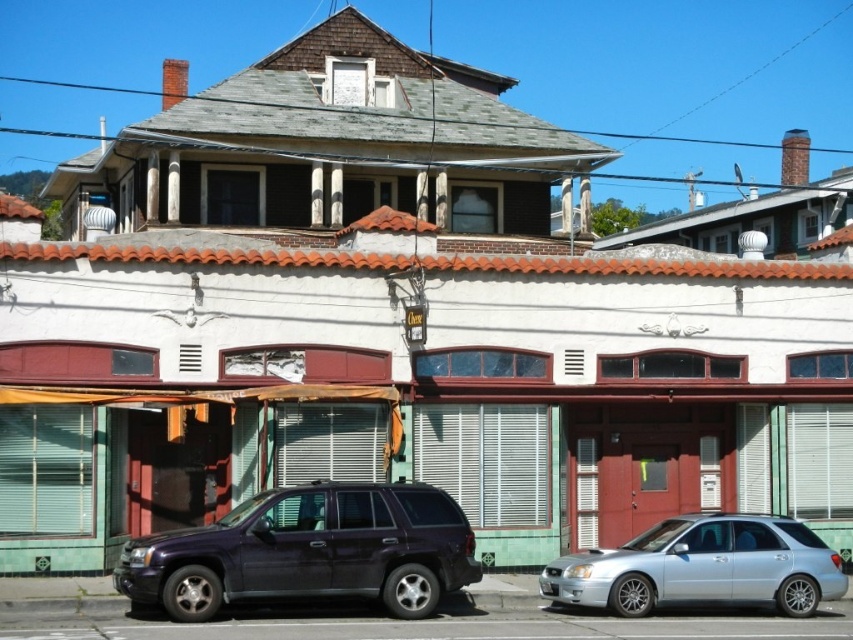
Is glossy dark blue suv at center closer to the viewer compared to silver metallic sedan at lower right?

That is True.

Who is shorter, glossy dark blue suv at center or silver metallic sedan at lower right?

silver metallic sedan at lower right is shorter.

Image resolution: width=853 pixels, height=640 pixels. I want to click on glossy dark blue suv at center, so click(308, 552).

Where is `glossy dark blue suv at center`? This screenshot has height=640, width=853. glossy dark blue suv at center is located at coordinates (308, 552).